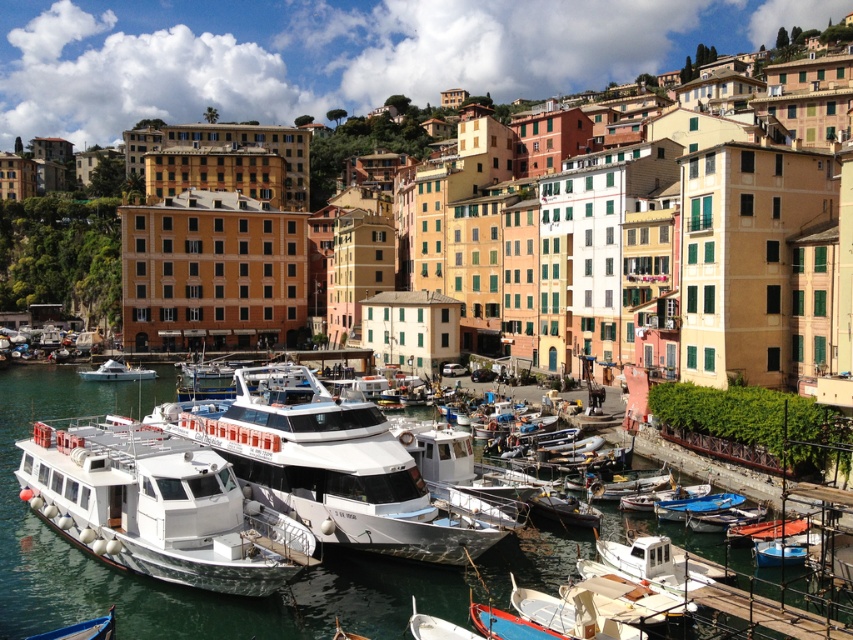
Question: Is white glossy water at center further to the viewer compared to white glossy boat at center?

Choices:
 (A) yes
 (B) no

Answer: (B)

Question: Which point is closer to the camera?

Choices:
 (A) white glossy yacht at center
 (B) white glossy water at center
 (C) white glossy boat at center

Answer: (B)

Question: Does white glossy water at center have a smaller size compared to white glossy boat at lower left?

Choices:
 (A) no
 (B) yes

Answer: (A)

Question: Can you confirm if white glossy water at center is smaller than white glossy boat at lower left?

Choices:
 (A) no
 (B) yes

Answer: (A)

Question: Which is farther from the white glossy boat at lower left?

Choices:
 (A) white glossy water at center
 (B) white glossy boat at center
 (C) blue polished wood boat at lower left

Answer: (B)

Question: Which of the following is the closest to the observer?

Choices:
 (A) (82, 636)
 (B) (161, 518)

Answer: (A)